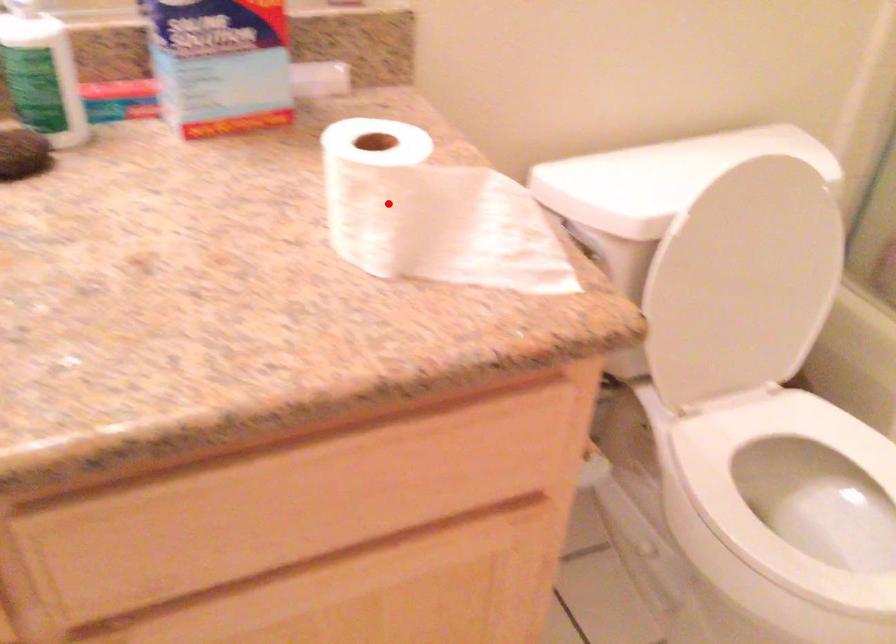
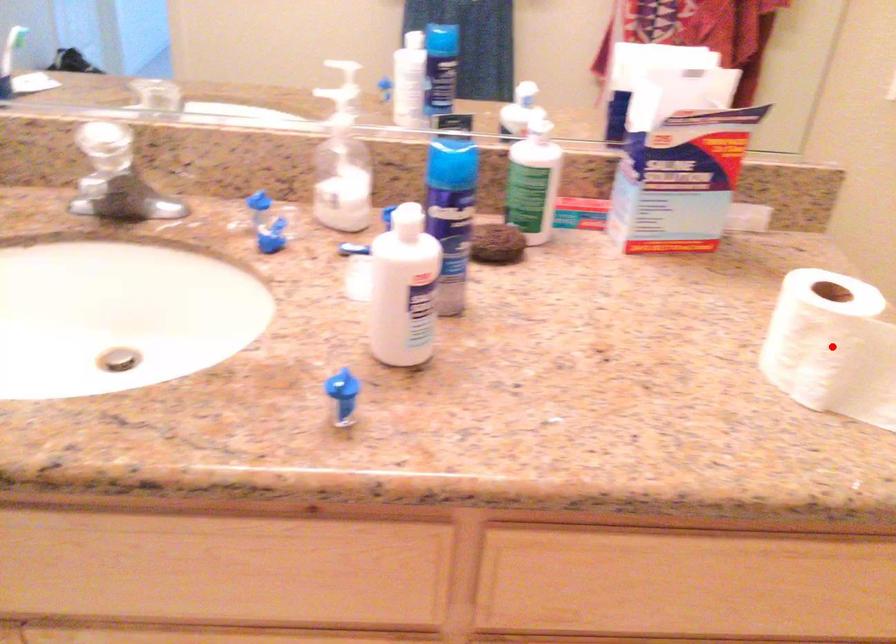
I am providing you with two images of the same scene from different viewpoints. A red point is marked on the first image and another point is marked on the second image. Is the red point in image1 aligned with the point shown in image2?

Yes